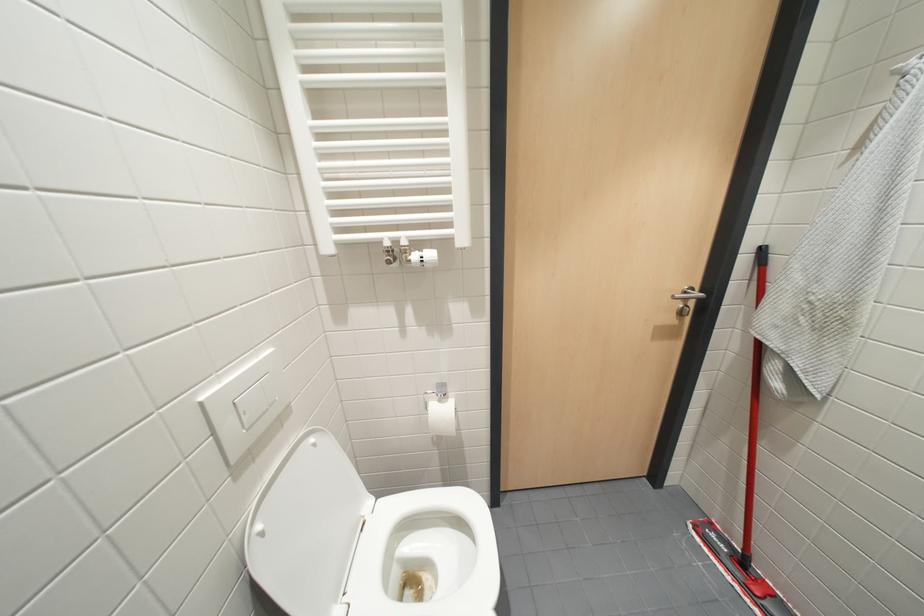
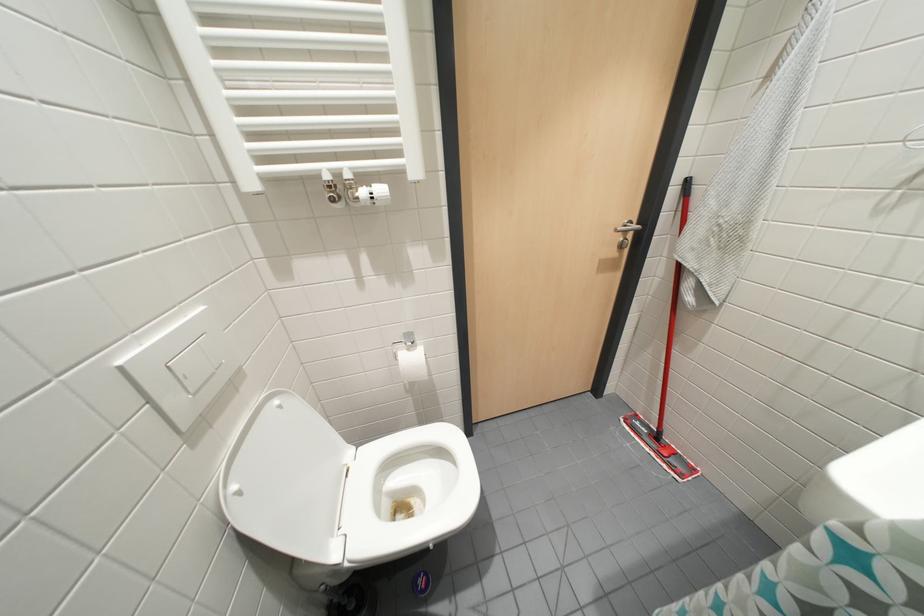
Question: The camera is either moving clockwise (left) or counter-clockwise (right) around the object. The first image is from the beginning of the video and the second image is from the end. Is the camera moving left or right when shooting the video?

Choices:
 (A) Left
 (B) Right

Answer: (A)